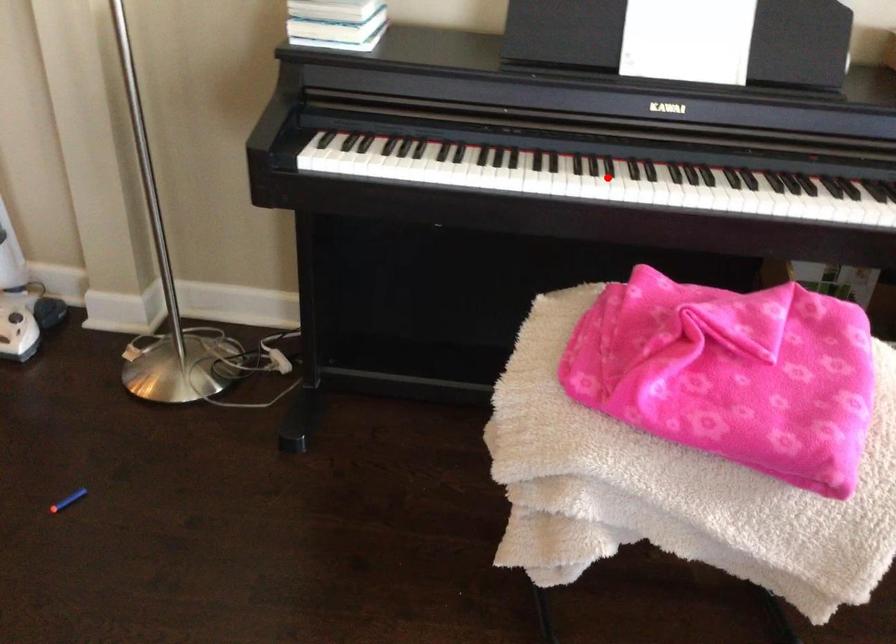
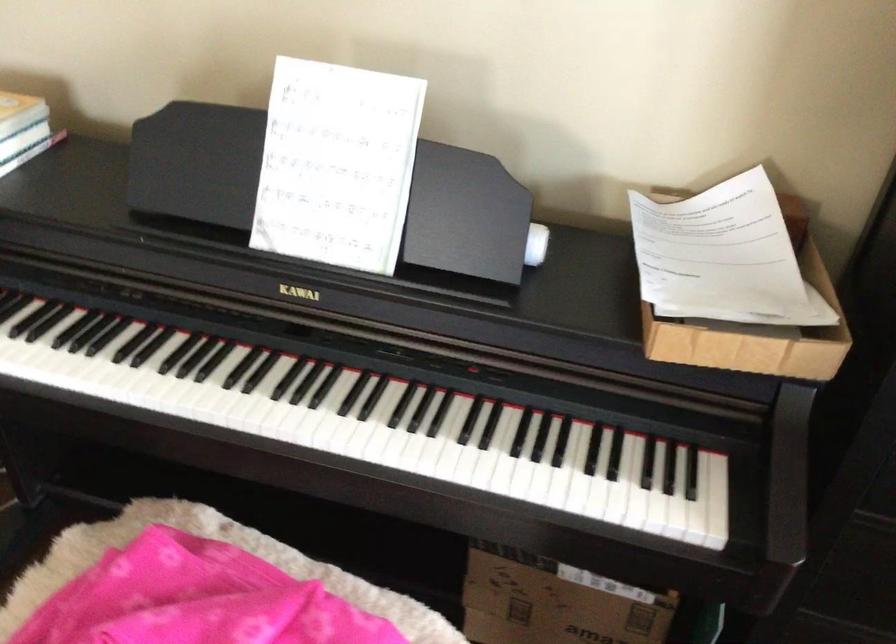
The point at the highlighted location is marked in the first image. Where is the corresponding point in the second image?

(177, 397)